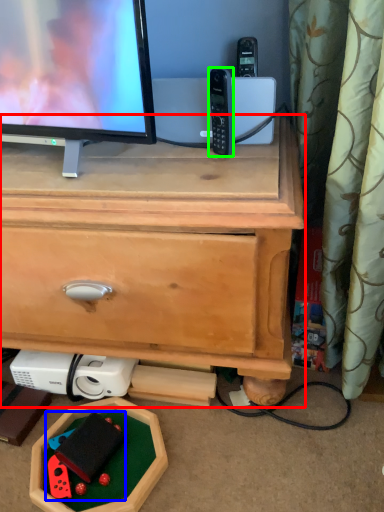
Question: Which is nearer to the chest of drawers (highlighted by a red box)? toy (highlighted by a blue box) or gadget (highlighted by a green box).

Choices:
 (A) toy
 (B) gadget

Answer: (B)